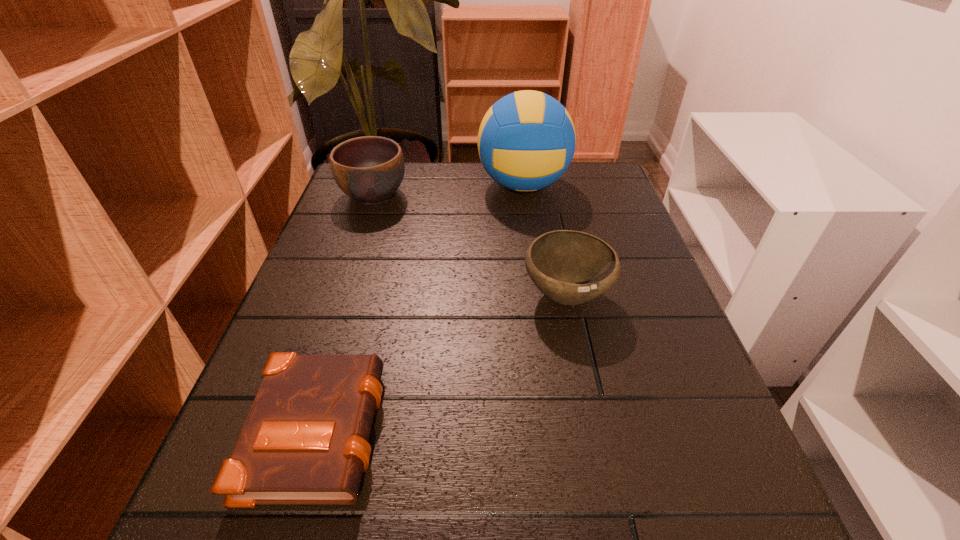
You are a GUI agent. You are given a task and a screenshot of the screen. Output one action in this format:
    pyautogui.click(x=<x>, y=<y>)
    Task: Click on the volleyball
    
    Given the screenshot: What is the action you would take?
    pyautogui.click(x=526, y=141)

The width and height of the screenshot is (960, 540). I want to click on the third shortest object, so click(370, 169).

In order to click on the taller bowl in this screenshot , I will do `click(370, 169)`.

I want to click on the third farthest object, so click(570, 267).

Find the location of a particular element. The image size is (960, 540). the nearer bowl is located at coordinates (570, 267).

I want to click on Bible, so click(x=305, y=440).

In order to click on the shortest object in this screenshot , I will do `click(305, 440)`.

The height and width of the screenshot is (540, 960). What are the coordinates of `free space located 0.050m on the left of the tallest object` in the screenshot? It's located at (459, 185).

You are a GUI agent. You are given a task and a screenshot of the screen. Output one action in this format:
    pyautogui.click(x=<x>, y=<y>)
    Task: Click on the free space located on the front of the left bowl
    This screenshot has height=540, width=960.
    Given the screenshot: What is the action you would take?
    pyautogui.click(x=353, y=256)

You are a GUI agent. You are given a task and a screenshot of the screen. Output one action in this format:
    pyautogui.click(x=<x>, y=<y>)
    Task: Click on the vacant position located 0.270m on the back of the second shortest object
    Image resolution: width=960 pixels, height=540 pixels.
    Given the screenshot: What is the action you would take?
    pyautogui.click(x=545, y=198)